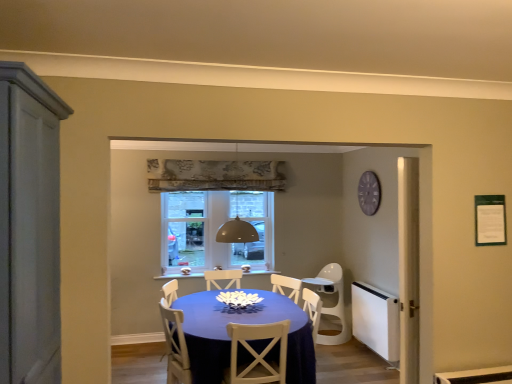
Question: Which direction should I rotate to look at white plastic chair at center, the second chair in the front-to-back sequence, — up or down?

Choices:
 (A) down
 (B) up

Answer: (A)

Question: Does white wood chair at center, which is the second chair from back to front, have a lesser width compared to white matte door at left?

Choices:
 (A) yes
 (B) no

Answer: (B)

Question: Does white wood chair at center, positioned as the 1th chair in front-to-back order, turn towards white matte door at left?

Choices:
 (A) no
 (B) yes

Answer: (A)

Question: Considering the relative sizes of white wood chair at center, the 1th chair in the left-to-right sequence, and white matte door at left in the image provided, is white wood chair at center, the 1th chair in the left-to-right sequence, taller than white matte door at left?

Choices:
 (A) yes
 (B) no

Answer: (B)

Question: From a real-world perspective, is white wood chair at center, which is the second chair from back to front, physically above white matte door at left?

Choices:
 (A) no
 (B) yes

Answer: (A)

Question: Considering the relative positions of white wood chair at center, which is the second chair from back to front, and white matte door at left in the image provided, is white wood chair at center, which is the second chair from back to front, to the left of white matte door at left from the viewer's perspective?

Choices:
 (A) yes
 (B) no

Answer: (B)

Question: Are white wood chair at center, the second chair from the right, and white matte door at left located far from each other?

Choices:
 (A) no
 (B) yes

Answer: (B)

Question: From the image's perspective, would you say white matte radiator at right is shown under white plastic chair at center, acting as the 1th chair starting from the right?

Choices:
 (A) yes
 (B) no

Answer: (A)

Question: Is white matte radiator at right taller than white plastic chair at center, acting as the 1th chair starting from the right?

Choices:
 (A) yes
 (B) no

Answer: (B)

Question: Does white matte radiator at right have a smaller size compared to white plastic chair at center, positioned as the first chair in back-to-front order?

Choices:
 (A) yes
 (B) no

Answer: (A)

Question: Does white matte radiator at right lie in front of white plastic chair at center, acting as the 1th chair starting from the right?

Choices:
 (A) yes
 (B) no

Answer: (A)

Question: Is white matte radiator at right facing towards white plastic chair at center, acting as the 1th chair starting from the right?

Choices:
 (A) yes
 (B) no

Answer: (B)

Question: Does white matte radiator at right appear on the right side of white plastic chair at center, the second chair in the front-to-back sequence?

Choices:
 (A) no
 (B) yes

Answer: (B)

Question: Can you confirm if purple wooden clock at upper right is thinner than matte blue table at center?

Choices:
 (A) no
 (B) yes

Answer: (B)